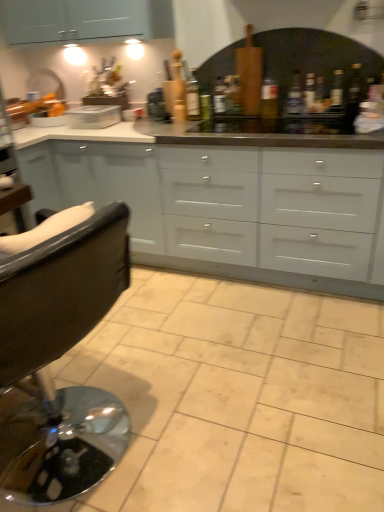
Identify the location of vacant space in front of green glass bottle at center, arranged as the 5th bottle when viewed from the right. pyautogui.click(x=241, y=123).